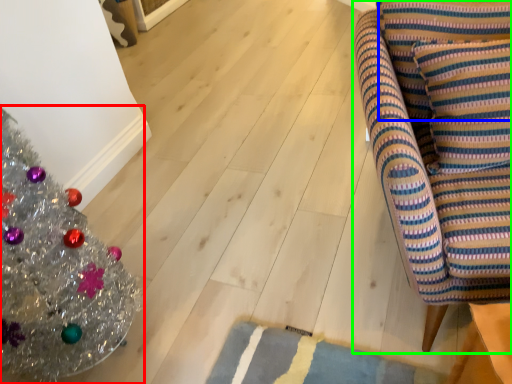
Question: Based on their relative distances, which object is nearer to christmas tree (highlighted by a red box)? Choose from pillow (highlighted by a blue box) and furniture (highlighted by a green box).

Choices:
 (A) pillow
 (B) furniture

Answer: (B)